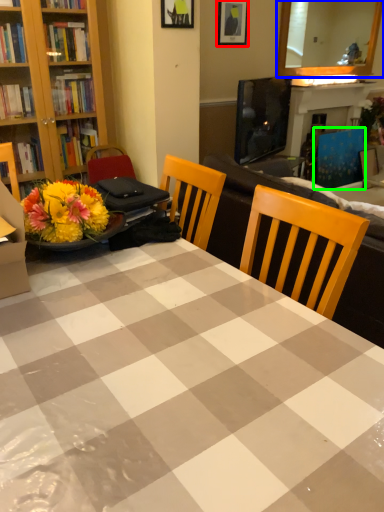
Question: Considering the real-world distances, which object is closest to picture frame (highlighted by a red box)? mirror (highlighted by a blue box) or armchair (highlighted by a green box).

Choices:
 (A) mirror
 (B) armchair

Answer: (B)